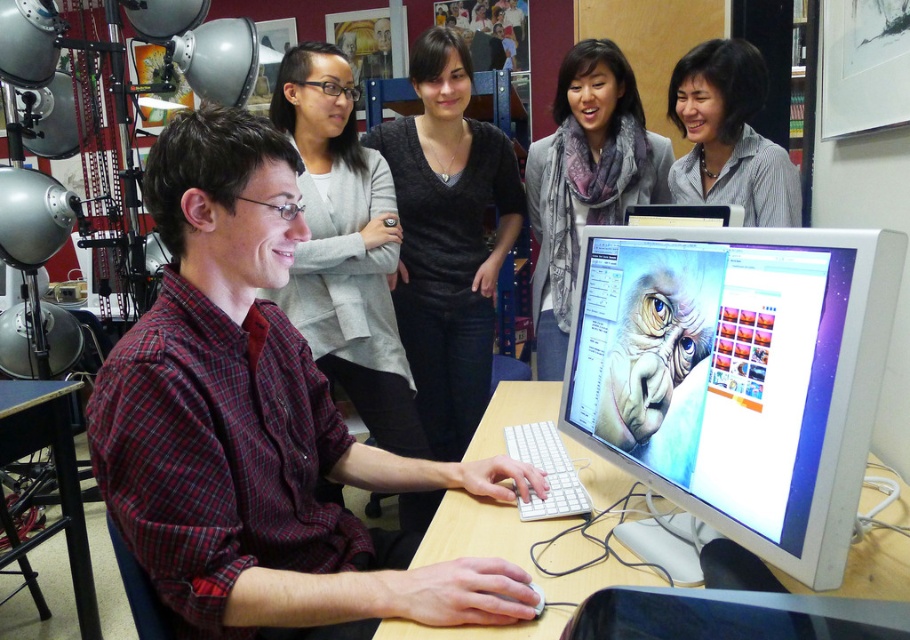
Between wooden table at center and gray striped shirt at upper right, which one has less height?

With less height is wooden table at center.

Can you confirm if wooden table at center is positioned to the right of gray striped shirt at upper right?

Incorrect, wooden table at center is not on the right side of gray striped shirt at upper right.

What are the coordinates of `wooden table at center` in the screenshot? It's located at (511, 561).

Find the location of a particular element. wooden table at center is located at coordinates (511, 561).

Can you confirm if gray striped shirt at upper right is bigger than black wood table at lower left?

No.

Is gray striped shirt at upper right wider than black wood table at lower left?

Incorrect, gray striped shirt at upper right's width does not surpass black wood table at lower left's.

Locate an element on the screen. The width and height of the screenshot is (910, 640). gray striped shirt at upper right is located at coordinates (728, 134).

Which is below, gray scarf at upper center or gray striped shirt at upper right?

Positioned lower is gray scarf at upper center.

Can you confirm if gray scarf at upper center is smaller than gray striped shirt at upper right?

Actually, gray scarf at upper center might be larger than gray striped shirt at upper right.

Find the location of a particular element. The image size is (910, 640). gray scarf at upper center is located at coordinates point(585,179).

I want to click on gray scarf at upper center, so click(585, 179).